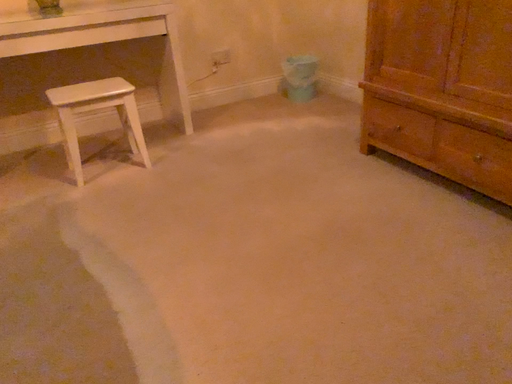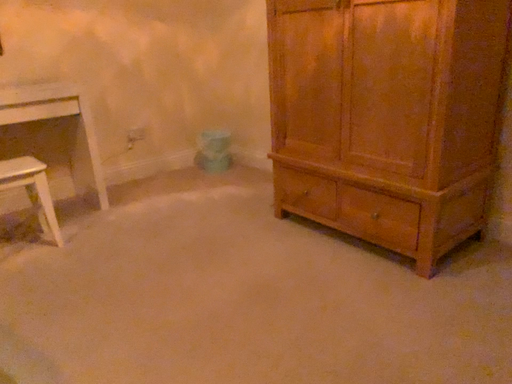
Question: How did the camera likely rotate when shooting the video?

Choices:
 (A) rotated left
 (B) rotated right

Answer: (B)